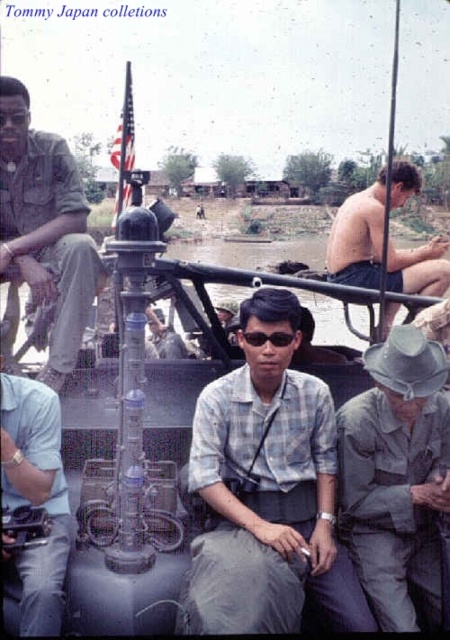
Question: Which point appears closest to the camera in this image?

Choices:
 (A) (52, 586)
 (B) (413, 477)
 (C) (284, 522)
 (D) (436, 291)

Answer: (A)

Question: Which object is the farthest from the plaid shirt at center?

Choices:
 (A) light blue shirt at center
 (B) brushed metal helmet at upper left
 (C) black plastic goggles at center

Answer: (B)

Question: Which point appears closest to the camera in this image?

Choices:
 (A) (369, 195)
 (B) (262, 401)

Answer: (B)

Question: In this image, where is gray matte uniform at lower right located relative to shiny blue shorts at right?

Choices:
 (A) above
 (B) below

Answer: (B)

Question: Is gray matte uniform at lower right above light blue shirt at center?

Choices:
 (A) yes
 (B) no

Answer: (A)

Question: Does shiny blue shorts at right appear on the left side of black plastic goggles at center?

Choices:
 (A) yes
 (B) no

Answer: (B)